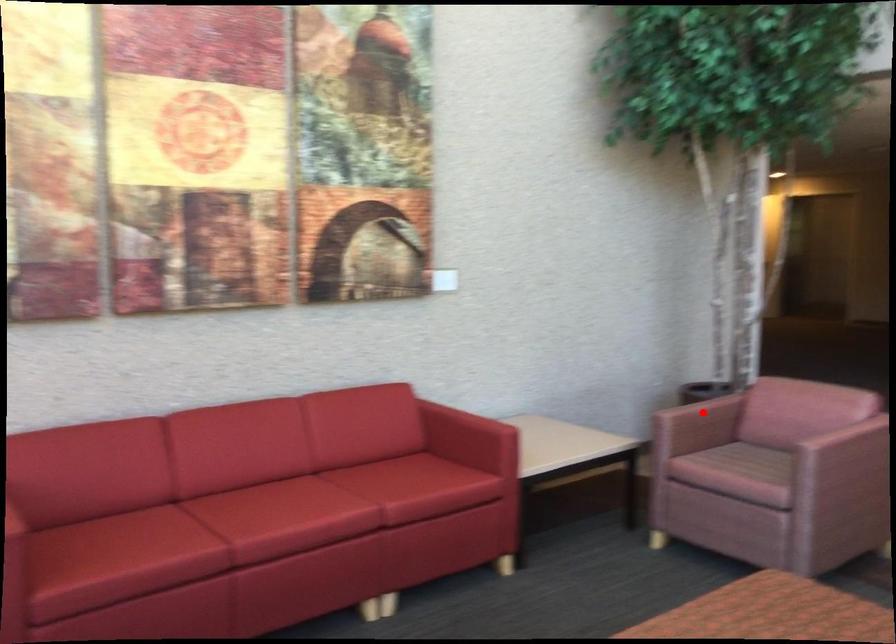
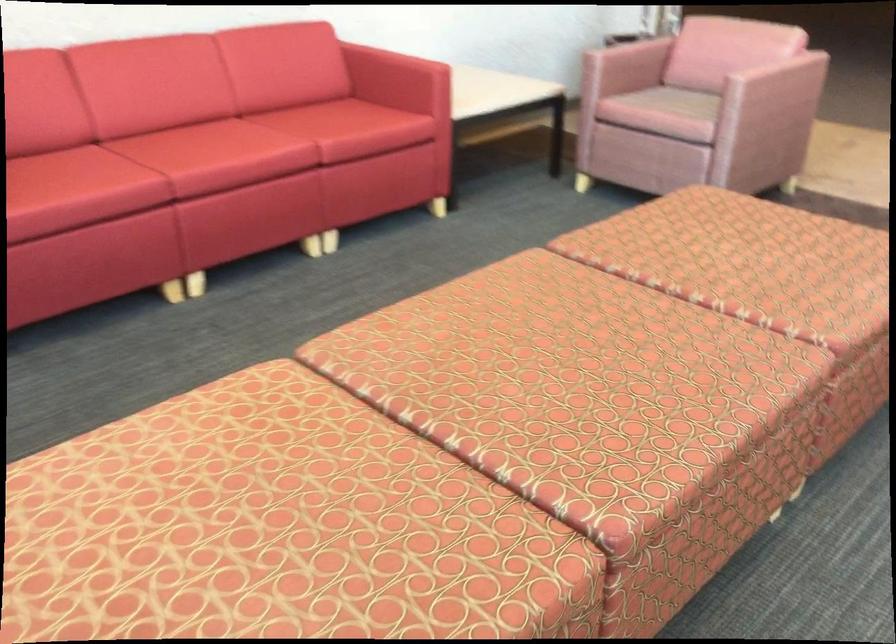
Locate, in the second image, the point that corresponds to the highlighted location in the first image.

(627, 58)